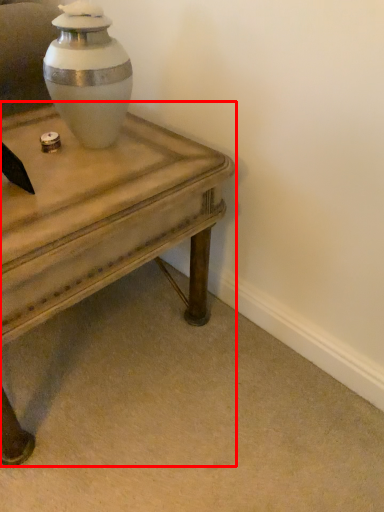
Question: Observing the image, what is the correct spatial positioning of table (annotated by the red box) in reference to vase?

Choices:
 (A) left
 (B) right

Answer: (A)